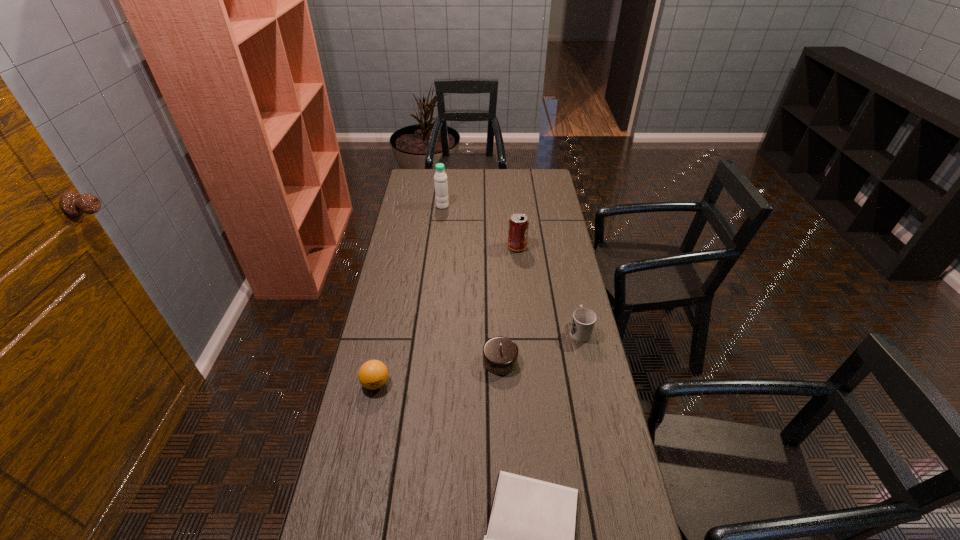
I want to click on vacant area situated 0.380m on the front of the chocolate cake, so click(506, 498).

You are a GUI agent. You are given a task and a screenshot of the screen. Output one action in this format:
    pyautogui.click(x=<x>, y=<y>)
    Task: Click on the vacant space situated on the side with brand of the leftmost object
    The image size is (960, 540).
    Given the screenshot: What is the action you would take?
    pyautogui.click(x=346, y=530)

Identify the location of free space located on the side of the cup where the handle is located. (574, 303).

This screenshot has width=960, height=540. Identify the location of vacant space located on the side of the cup where the handle is located. (563, 252).

The height and width of the screenshot is (540, 960). What are the coordinates of `vacant space located 0.180m on the side of the cup where the handle is located` in the screenshot? It's located at pos(570,285).

The image size is (960, 540). Find the location of `object located in the left edge section of the desktop`. object located in the left edge section of the desktop is located at coordinates (373, 374).

You are a GUI agent. You are given a task and a screenshot of the screen. Output one action in this format:
    pyautogui.click(x=<x>, y=<y>)
    Task: Click on the object present at the right edge
    The image size is (960, 540).
    Given the screenshot: What is the action you would take?
    pyautogui.click(x=583, y=321)

This screenshot has height=540, width=960. Identify the location of free point at the far edge. pos(487,188).

This screenshot has height=540, width=960. Identify the location of free space at the left edge of the desktop. (386, 339).

In the image, there is a desktop. Where is `vacant space at the right edge`? This screenshot has height=540, width=960. vacant space at the right edge is located at coordinates (561, 306).